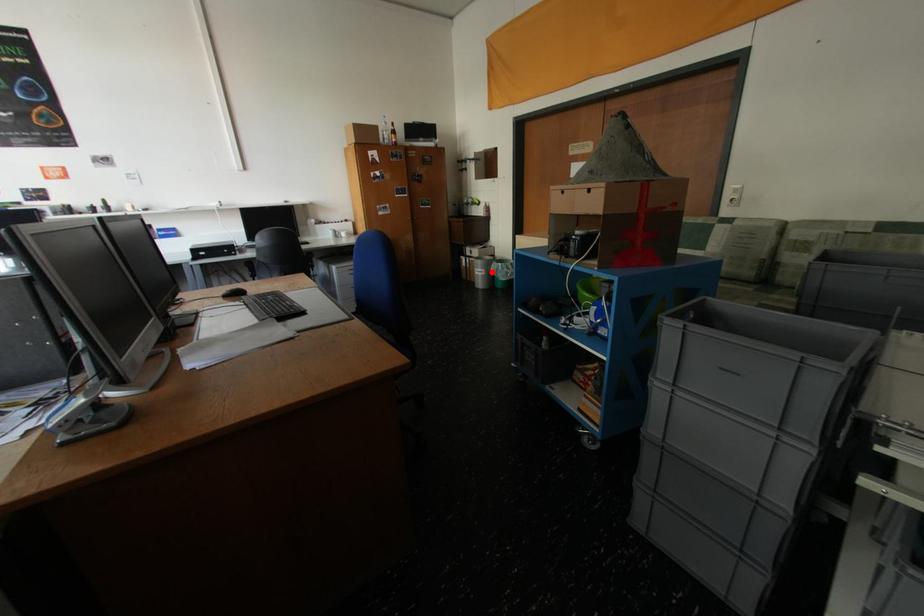
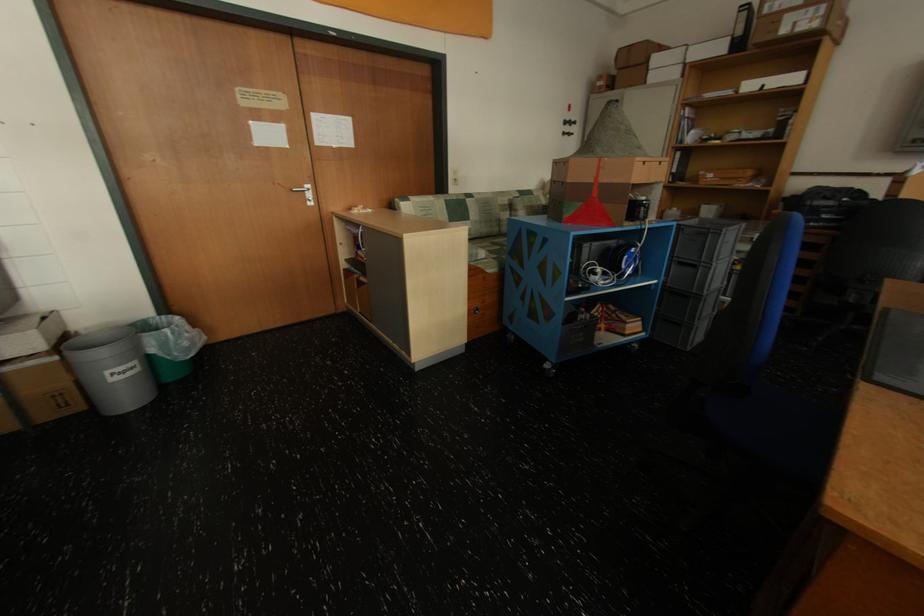
Question: I am providing you with two images of the same scene from different viewpoints. In image1, a red point is highlighted. Considering the same 3D point in image2, which of the following is correct?

Choices:
 (A) It is closer
 (B) It is farther

Answer: (B)